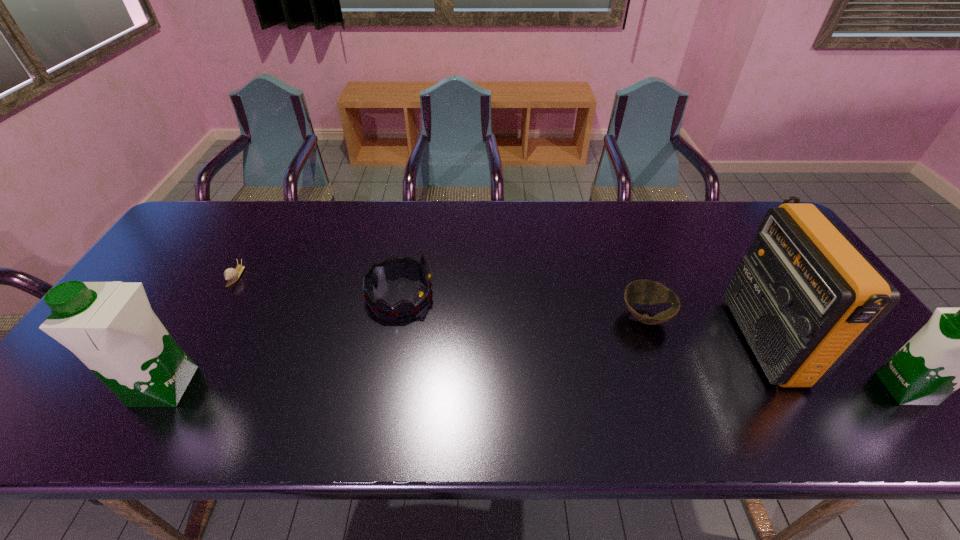
Where is `object that is at the near right corner`? object that is at the near right corner is located at coordinates (957, 348).

I want to click on free space at the far edge, so click(x=642, y=219).

In the image, there is a desktop. Identify the location of vacant space at the near edge. (608, 383).

Find the location of `vacant area at the left edge`. vacant area at the left edge is located at coordinates (193, 287).

You are a GUI agent. You are given a task and a screenshot of the screen. Output one action in this format:
    pyautogui.click(x=<x>, y=<y>)
    Task: Click on the vacant space at the far left corner of the desktop
    This screenshot has height=540, width=960.
    Given the screenshot: What is the action you would take?
    pyautogui.click(x=240, y=204)

Identify the location of free spot at the far right corner of the desktop. Image resolution: width=960 pixels, height=540 pixels. (734, 224).

What are the coordinates of `vacant area that lies between the fourth object from right to left and the taller soya milk` in the screenshot? It's located at (282, 340).

Image resolution: width=960 pixels, height=540 pixels. I want to click on unoccupied position between the third object from right to left and the taller soya milk, so click(405, 352).

Where is `free point between the fourth object from left to right and the shortest object`? This screenshot has width=960, height=540. free point between the fourth object from left to right and the shortest object is located at coordinates (441, 296).

Find the location of a particular element. The height and width of the screenshot is (540, 960). free space between the taller soya milk and the third tallest object is located at coordinates (535, 388).